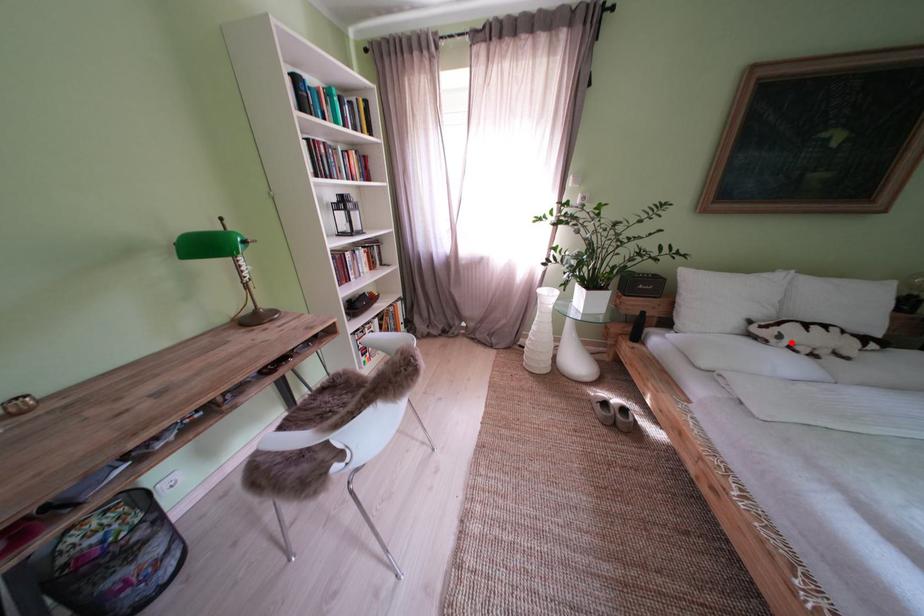
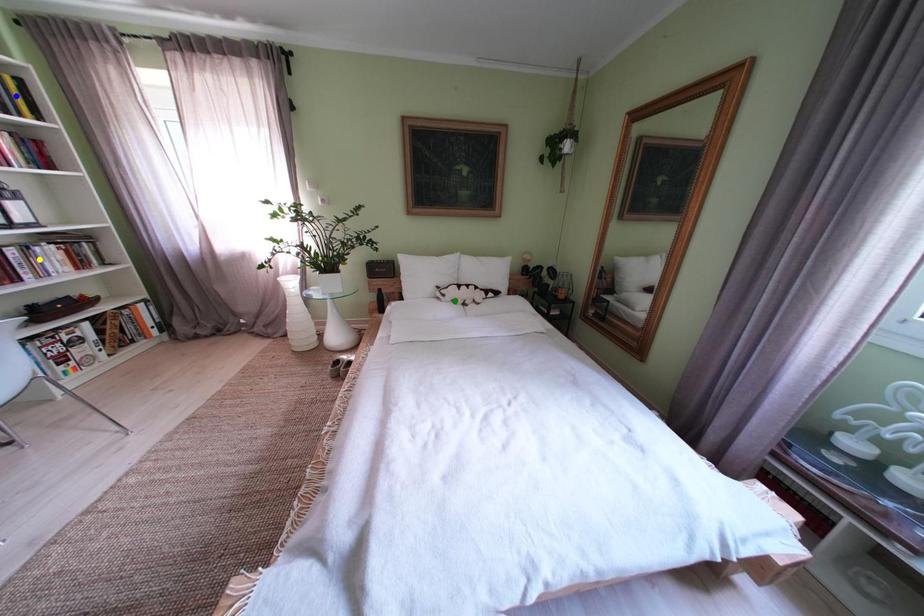
Question: I am providing you with two images of the same scene from different viewpoints. A red point is marked on the first image. You are given multiple points on the second image. Which spot in image 2 lines up with the point in image 1?

Choices:
 (A) green point
 (B) blue point
 (C) yellow point

Answer: (A)